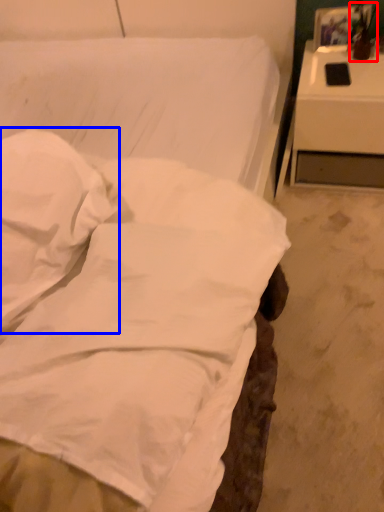
Question: Which of the following is the farthest to the observer, table lamp (highlighted by a red box) or pillow (highlighted by a blue box)?

Choices:
 (A) table lamp
 (B) pillow

Answer: (A)